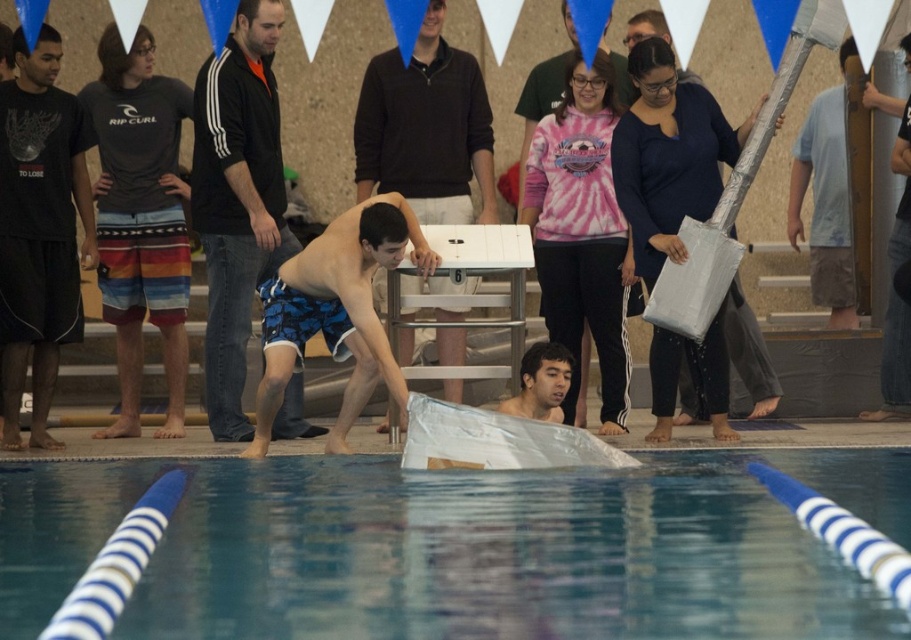
Who is more forward, [18,157] or [679,70]?

Point [18,157]

Can you confirm if black cotton t-shirt at left is taller than silver reflective guitar at center?

Yes, black cotton t-shirt at left is taller than silver reflective guitar at center.

Consider the image. Who is more forward, (5,433) or (759,384)?

Point (5,433)

Locate an element on the screen. black cotton t-shirt at left is located at coordinates (39, 230).

Can you confirm if blue patterned shorts at center is taller than pink tie-dye shirt at center?

Indeed, blue patterned shorts at center has a greater height compared to pink tie-dye shirt at center.

Is blue patterned shorts at center wider than pink tie-dye shirt at center?

Indeed, blue patterned shorts at center has a greater width compared to pink tie-dye shirt at center.

The height and width of the screenshot is (640, 911). In order to click on blue patterned shorts at center in this screenshot , I will do `click(426, 129)`.

Identify the location of blue patterned shorts at center. (426, 129).

Is black cotton t-shirt at left wider than blue patterned shorts at center?

Incorrect, black cotton t-shirt at left's width does not surpass blue patterned shorts at center's.

Where is `black cotton t-shirt at left`? Image resolution: width=911 pixels, height=640 pixels. black cotton t-shirt at left is located at coordinates (39, 230).

What do you see at coordinates (39, 230) in the screenshot?
I see `black cotton t-shirt at left` at bounding box center [39, 230].

Identify the location of black cotton t-shirt at left. (39, 230).